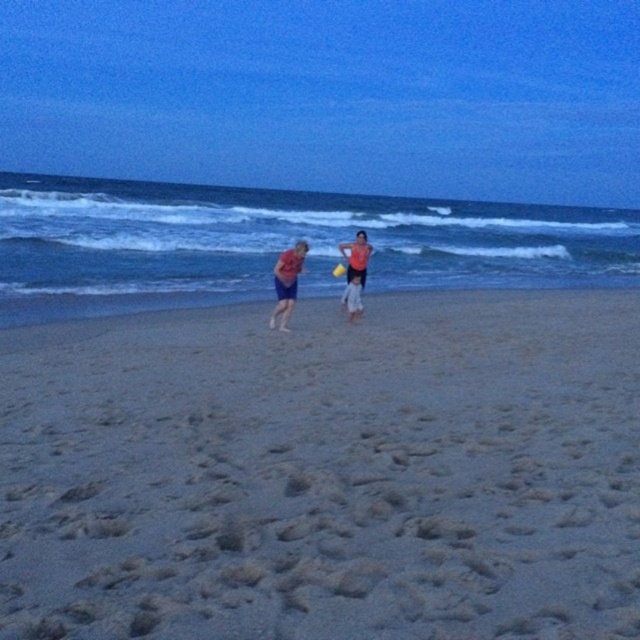
Is the position of matte pink shirt at center less distant than that of matte pink shorts at center?

That is True.

Does matte pink shirt at center have a greater height compared to matte pink shorts at center?

No.

Describe the element at coordinates (285, 284) in the screenshot. I see `matte pink shirt at center` at that location.

In order to click on matte pink shirt at center in this screenshot , I will do `click(285, 284)`.

Which is more to the right, fine-grained sand at center or matte blue shorts at center?

Positioned to the right is fine-grained sand at center.

Which is behind, point (189, 522) or point (280, 280)?

The point (280, 280) is more distant.

Which is in front, point (368, 492) or point (272, 314)?

Point (368, 492)

You are a GUI agent. You are given a task and a screenshot of the screen. Output one action in this format:
    pyautogui.click(x=<x>, y=<y>)
    Task: Click on the fine-grained sand at center
    
    Given the screenshot: What is the action you would take?
    pyautogui.click(x=324, y=472)

Which is more to the right, matte pink shirt at center or matte blue shorts at center?

matte blue shorts at center is more to the right.

Which is in front, point (282, 273) or point (278, 259)?

Point (278, 259)

Image resolution: width=640 pixels, height=640 pixels. What do you see at coordinates (285, 284) in the screenshot?
I see `matte pink shirt at center` at bounding box center [285, 284].

Locate an element on the screen. This screenshot has height=640, width=640. matte pink shirt at center is located at coordinates (285, 284).